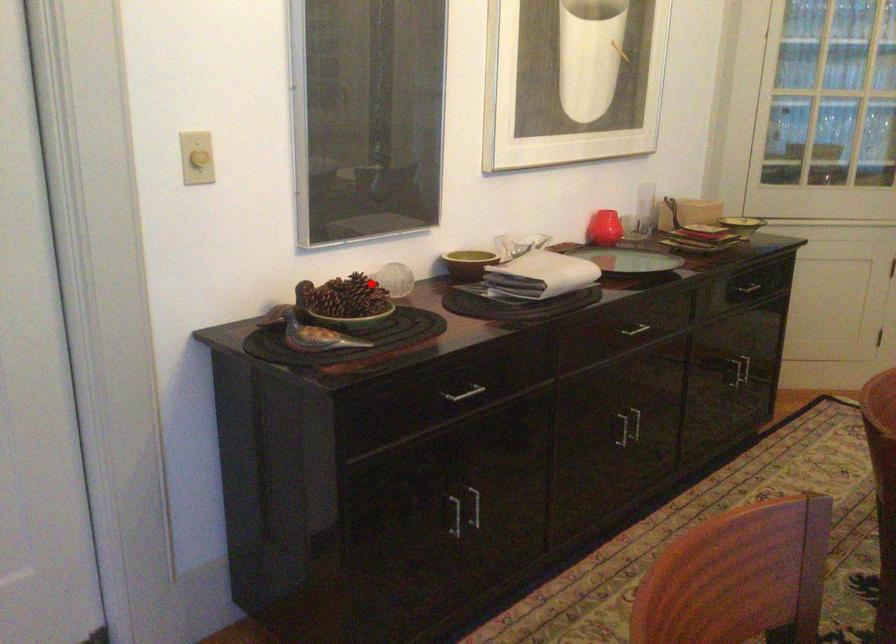
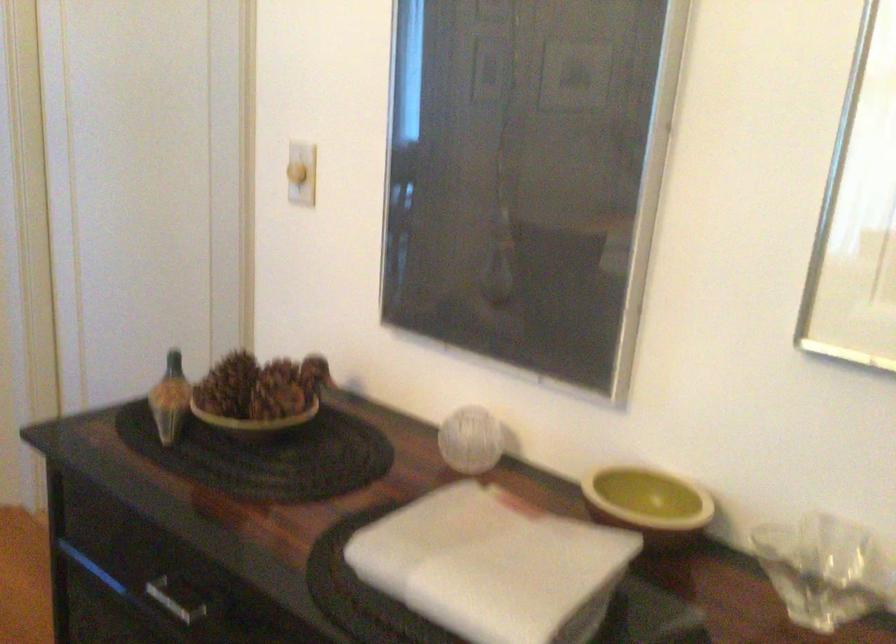
The point at the highlighted location is marked in the first image. Where is the corresponding point in the second image?

(259, 395)